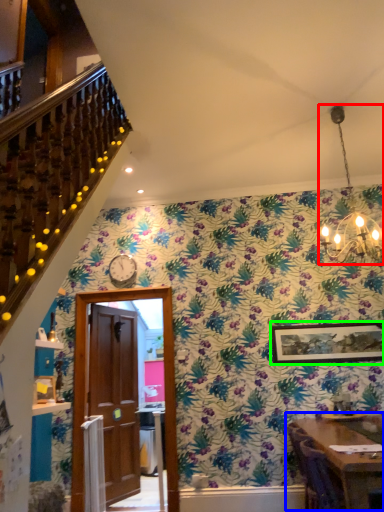
Question: Based on their relative distances, which object is nearer to light fixture (highlighted by a red box)? Choose from table (highlighted by a blue box) and picture frame (highlighted by a green box).

Choices:
 (A) table
 (B) picture frame

Answer: (A)